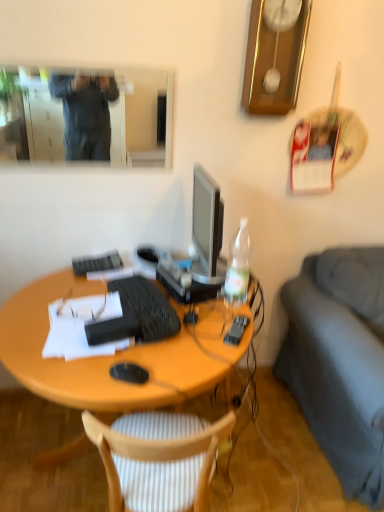
Find the location of a particular element. Image resolution: width=384 pixels, height=512 pixels. vacant space to the right of black matte computer mouse at center is located at coordinates (182, 368).